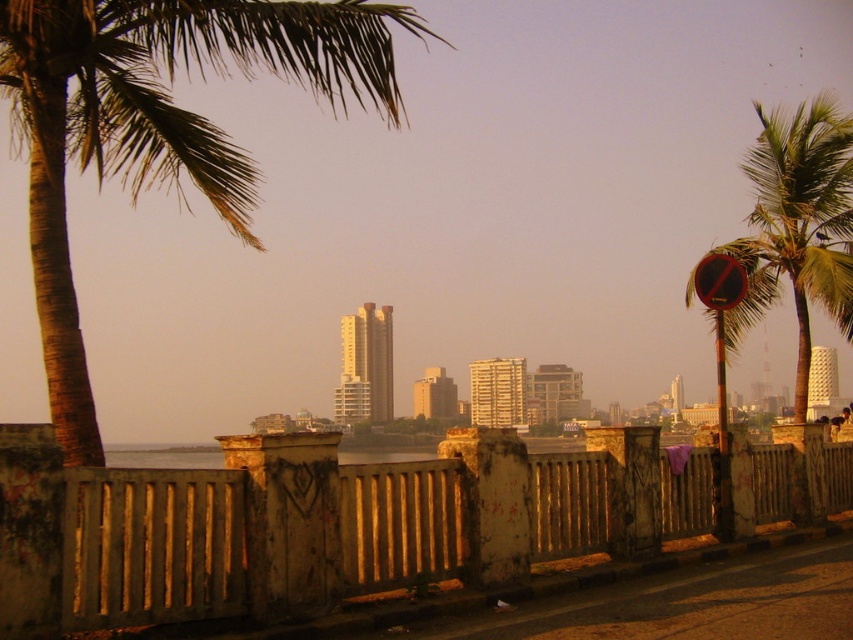
Question: Which object appears farthest from the camera in this image?

Choices:
 (A) brown textured palm tree at upper left
 (B) red plastic sign at right
 (C) green leafy palm tree at right
 (D) rusty metal fence at center

Answer: (C)

Question: Does green leafy palm tree at right have a smaller size compared to red plastic sign at right?

Choices:
 (A) yes
 (B) no

Answer: (B)

Question: Which object appears closest to the camera in this image?

Choices:
 (A) red plastic sign at right
 (B) brown textured palm tree at upper left
 (C) rusty metal fence at center

Answer: (B)

Question: Which object is positioned closest to the rusty metal fence at center?

Choices:
 (A) brown textured palm tree at upper left
 (B) green leafy palm tree at right
 (C) red plastic sign at right

Answer: (C)

Question: Is rusty metal fence at center below red plastic sign at right?

Choices:
 (A) yes
 (B) no

Answer: (B)

Question: Does rusty metal fence at center come in front of brown textured palm tree at upper left?

Choices:
 (A) yes
 (B) no

Answer: (B)